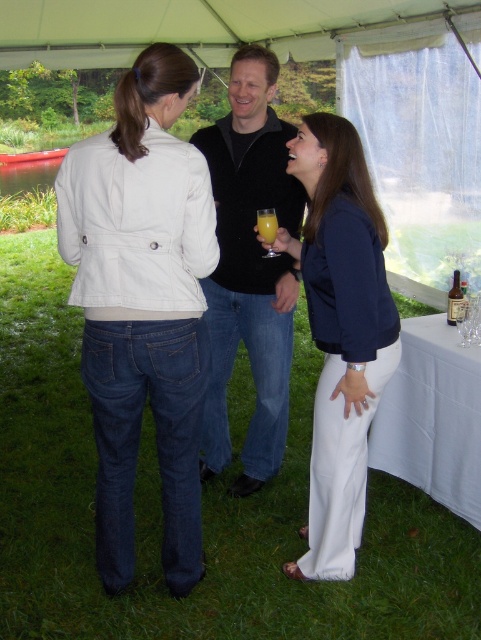
Question: Which object is closer to the camera taking this photo?

Choices:
 (A) white matte jacket at center
 (B) black sweater at center
 (C) translucent glass at center
 (D) brown glass bottle at lower right

Answer: (A)

Question: Estimate the real-world distances between objects in this image. Which object is closer to the white cloth table at lower right?

Choices:
 (A) brown glass bottle at lower right
 (B) white matte jacket at center

Answer: (A)

Question: Is black sweater at center positioned in front of brown glass bottle at lower right?

Choices:
 (A) yes
 (B) no

Answer: (A)

Question: Which is nearer to the white matte jacket at center?

Choices:
 (A) brown glass bottle at lower right
 (B) white cloth table at lower right

Answer: (B)

Question: Does white cloth table at lower right appear under brown glass bottle at lower right?

Choices:
 (A) no
 (B) yes

Answer: (B)

Question: Is translucent glass at center further to the viewer compared to brown glass bottle at lower right?

Choices:
 (A) yes
 (B) no

Answer: (B)